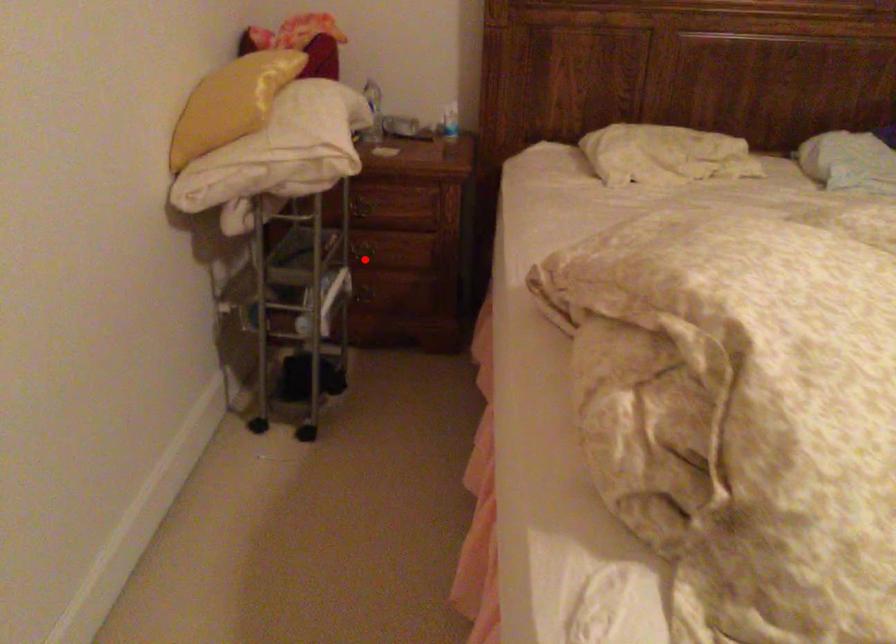
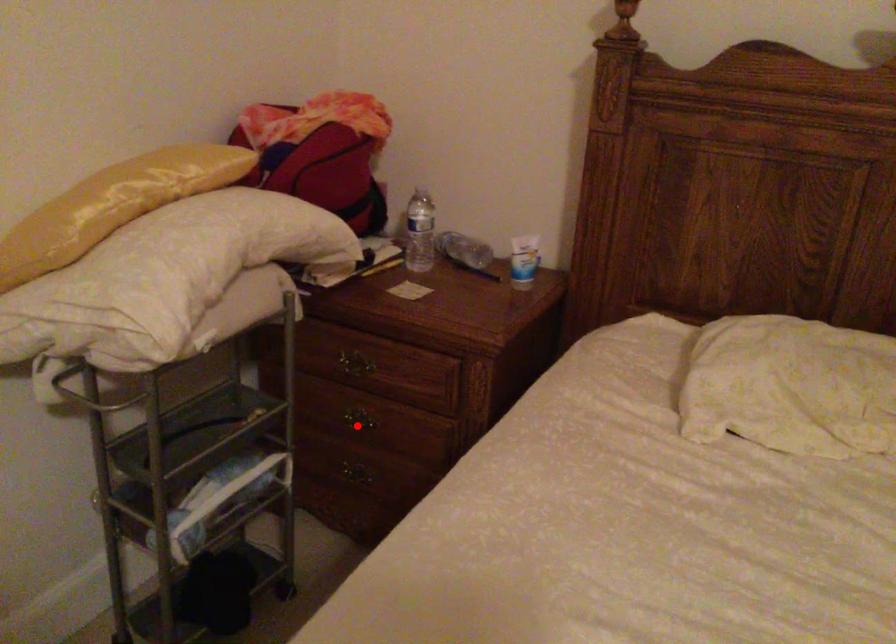
I am providing you with two images of the same scene from different viewpoints. A red point is marked on the first image and another point is marked on the second image. Are the points marked in image1 and image2 representing the same 3D position?

Yes